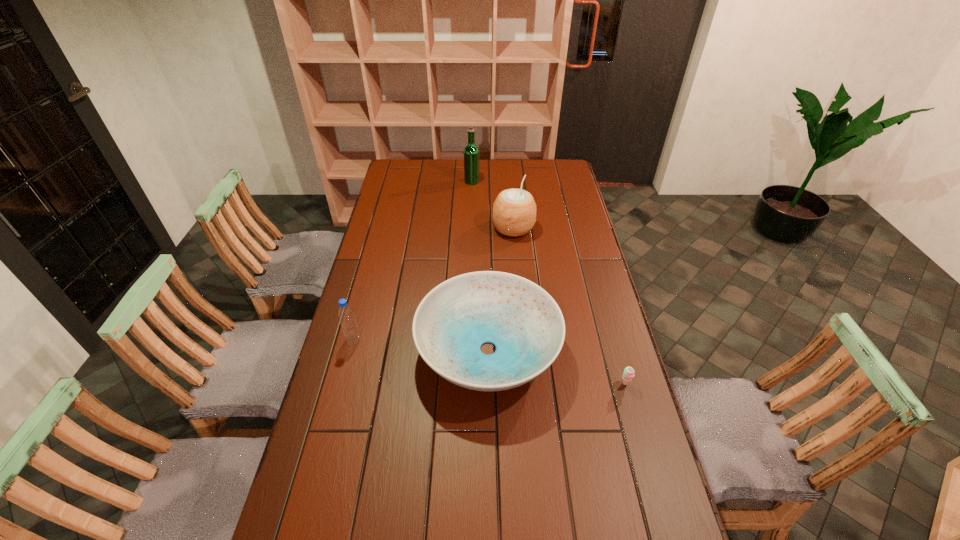
The height and width of the screenshot is (540, 960). I want to click on vacant space at the far right corner of the desktop, so click(544, 175).

At what (x,y) coordinates should I click in order to perform the action: click on free spot between the second farthest object and the rightmost object. Please return your answer as a coordinate pair (x, y). This screenshot has width=960, height=540. Looking at the image, I should click on (569, 306).

In order to click on free spot between the farthest object and the water bottle in this screenshot , I will do `click(413, 260)`.

You are a GUI agent. You are given a task and a screenshot of the screen. Output one action in this format:
    pyautogui.click(x=<x>, y=<y>)
    Task: Click on the vacant area that lies between the second shortest object and the sherbert
    The height and width of the screenshot is (540, 960).
    Given the screenshot: What is the action you would take?
    pyautogui.click(x=557, y=367)

This screenshot has height=540, width=960. I want to click on unoccupied area between the rightmost object and the second tallest object, so click(569, 306).

This screenshot has height=540, width=960. Find the location of `vacant area that lies between the rightmost object and the fourth nearest object`. vacant area that lies between the rightmost object and the fourth nearest object is located at coordinates (569, 306).

Select which object is the third closest to the fourth shortest object. Please provide its 2D coordinates. Your answer should be formatted as a tuple, i.e. [(x, y)], where the tuple contains the x and y coordinates of a point satisfying the conditions above.

[(346, 315)]

Identify the location of object identified as the second closest to the beer bottle. The image size is (960, 540). (522, 320).

Locate an element on the screen. This screenshot has height=540, width=960. vacant space that satisfies the following two spatial constraints: 1. on the front side of the rightmost object; 2. on the left side of the water bottle is located at coordinates (342, 383).